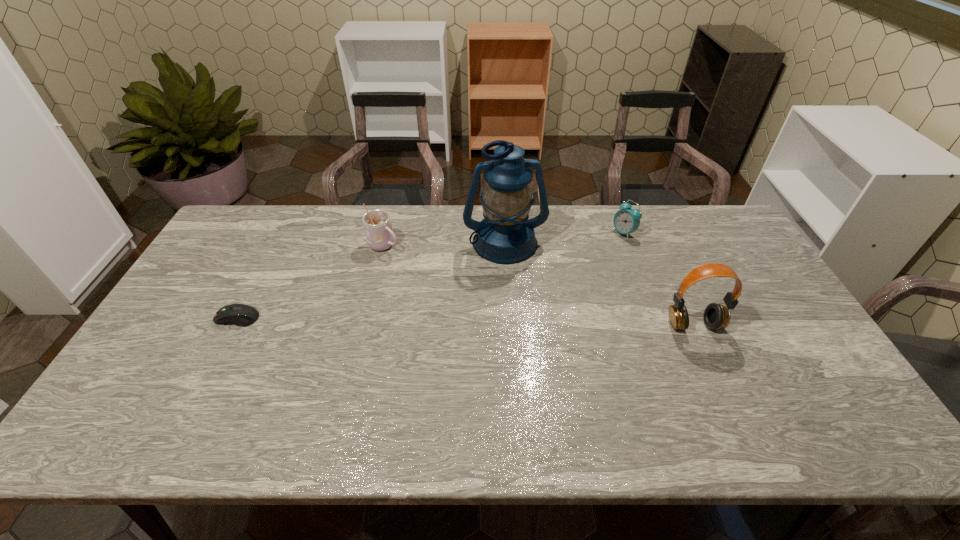
This screenshot has width=960, height=540. I want to click on free space on the desktop that is between the computer equipment and the second tallest object and is positioned on the face of the alarm clock, so click(510, 322).

The image size is (960, 540). I want to click on vacant space on the desktop that is between the computer equipment and the fourth shortest object and is positioned on the side with the handle of the second object from left to right, so click(516, 322).

At what (x,y) coordinates should I click in order to perform the action: click on free space on the desktop that is between the computer equipment and the headset and is positioned on the face of the tallest object. Please return your answer as a coordinate pair (x, y). Looking at the image, I should click on (522, 322).